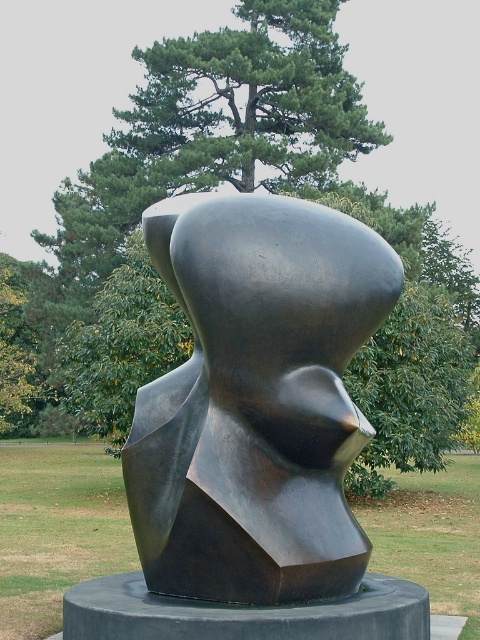
Between polished bronze bust at center and green leafy tree at upper center, which one has more height?

green leafy tree at upper center is taller.

Is point (299, 273) behind point (39, 54)?

No, (299, 273) is in front of (39, 54).

I want to click on polished bronze bust at center, so click(255, 401).